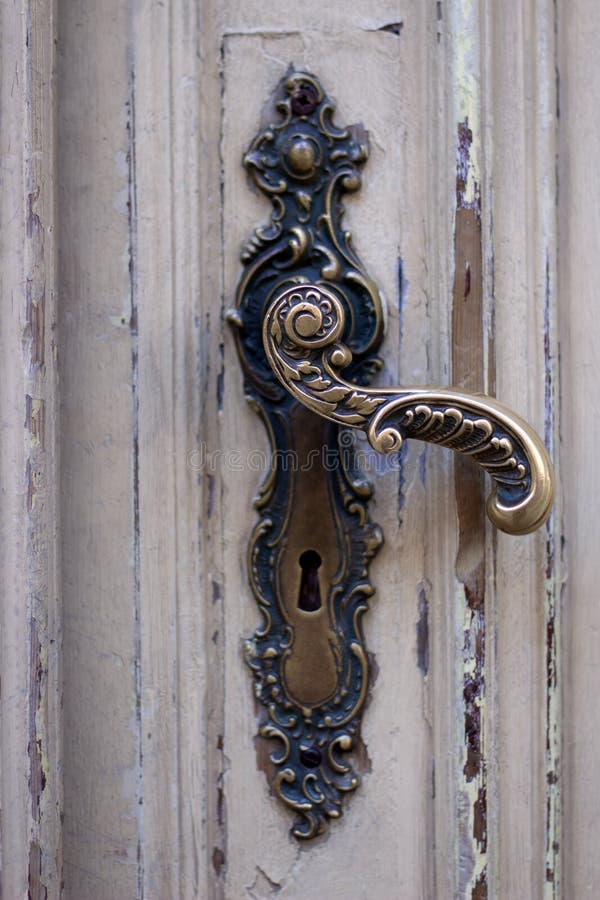
You are a GUI agent. You are given a task and a screenshot of the screen. Output one action in this format:
    pyautogui.click(x=<x>, y=<y>)
    Task: Click on the handle
    
    Given the screenshot: What is the action you would take?
    pyautogui.click(x=474, y=428)